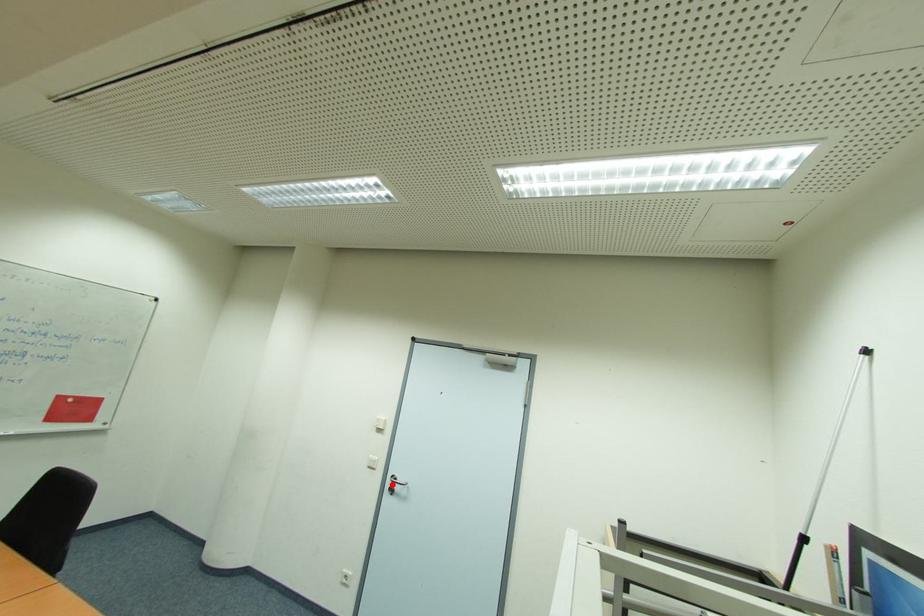
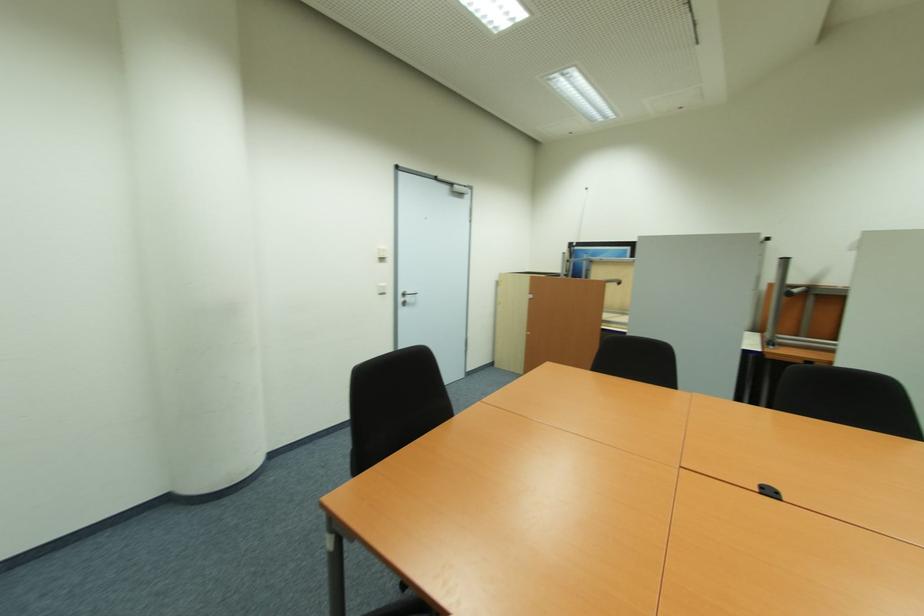
Question: A red point is marked in image1. In image2, is the corresponding 3D point closer to the camera or farther? Reply with the corresponding letter.

Choices:
 (A) The corresponding 3D point is closer.
 (B) The corresponding 3D point is farther.

Answer: (A)